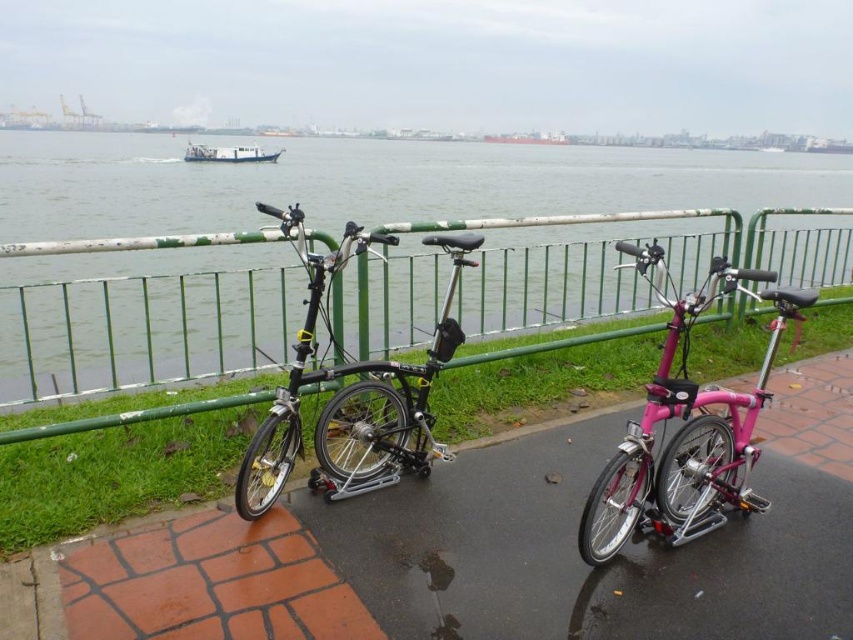
Question: Does pink matte bicycle at center appear over white matte boat at upper center?

Choices:
 (A) no
 (B) yes

Answer: (A)

Question: Which of these objects is positioned farthest from the black matte folding bike at center?

Choices:
 (A) pink matte bicycle at center
 (B) green metal fence at center
 (C) black rubber bicycle at center
 (D) white matte boat at upper center

Answer: (D)

Question: Which of the following is the closest to the observer?

Choices:
 (A) pink matte bicycle at center
 (B) white matte boat at upper center

Answer: (A)

Question: Which point is farther to the camera?

Choices:
 (A) black rubber bicycle at center
 (B) white matte boat at upper center
 (C) black matte folding bike at center

Answer: (B)

Question: Where is green metal fence at center located in relation to pink matte bicycle at center in the image?

Choices:
 (A) below
 (B) above

Answer: (B)

Question: Can you confirm if green metal fence at center is positioned above white matte boat at upper center?

Choices:
 (A) no
 (B) yes

Answer: (A)